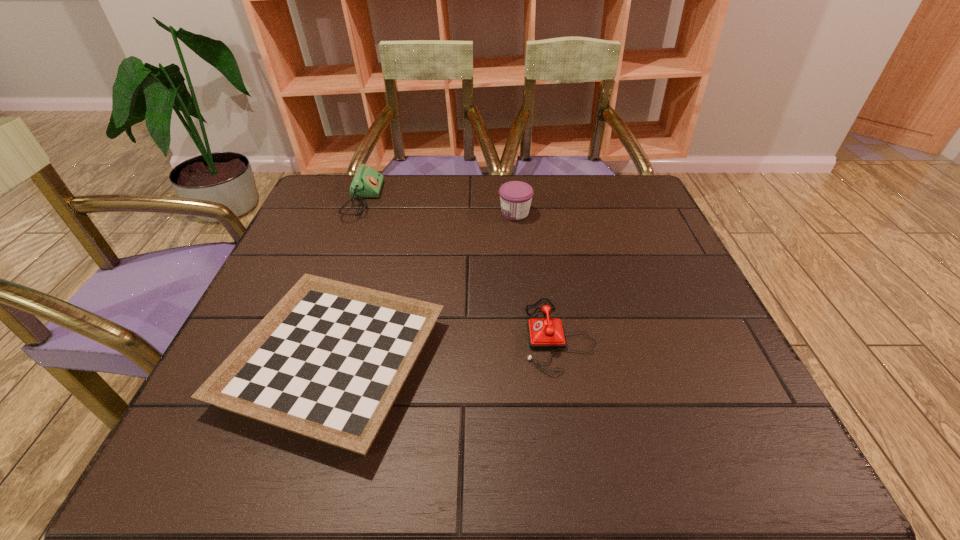
What are the coordinates of `vacant space situated 0.220m on the dial of the nearer telephone` in the screenshot? It's located at (414, 335).

I want to click on free space located on the dial of the nearer telephone, so click(494, 335).

At what (x,y) coordinates should I click in order to perform the action: click on vacant space located on the back of the checkerboard. Please return your answer as a coordinate pair (x, y). The image size is (960, 540). Looking at the image, I should click on (378, 217).

Where is `jam at the far edge`? jam at the far edge is located at coordinates (515, 196).

Identify the location of telephone located at the far edge. The image size is (960, 540). (367, 182).

This screenshot has width=960, height=540. I want to click on object present at the near edge, so click(328, 361).

Where is `telephone at the left edge`? This screenshot has height=540, width=960. telephone at the left edge is located at coordinates click(x=367, y=182).

I want to click on checkerboard positioned at the left edge, so click(328, 361).

Identify the location of object that is at the far left corner. (367, 182).

What are the coordinates of `object at the near left corner` in the screenshot? It's located at (328, 361).